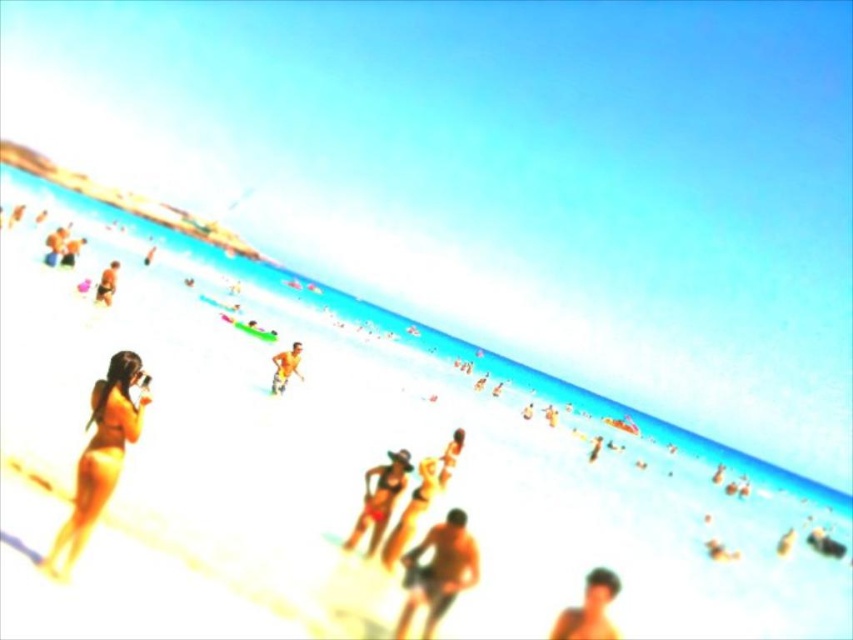
You are standing on the beach and want to walk to the water. You see two points marked on the sand, point 1 at coordinates point (361, 532) and point 2 at coordinates point (97, 296). Which point is closer to the water?

Point (361, 532) is in front of point (97, 296), so it is closer to the water.

You are standing on the beach and want to take a photo of the point at coordinates (607,632). Your camera has a maximum focus range of 25 feet. Will the camera be able to focus on the point?

The point at coordinates (607,632) is 26.96 feet away from the camera, which exceeds the maximum focus range of 25 feet. Therefore, the camera will not be able to focus on the point.